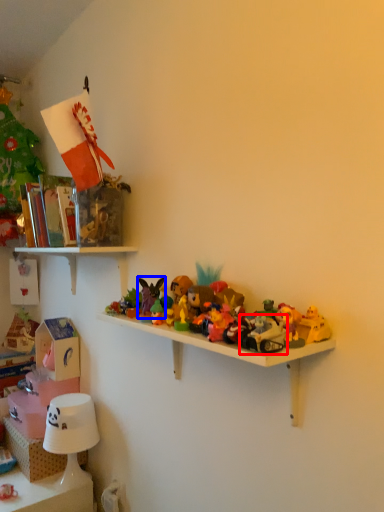
Question: Among these objects, which one is farthest to the camera, toy (highlighted by a red box) or toy (highlighted by a blue box)?

Choices:
 (A) toy
 (B) toy

Answer: (B)